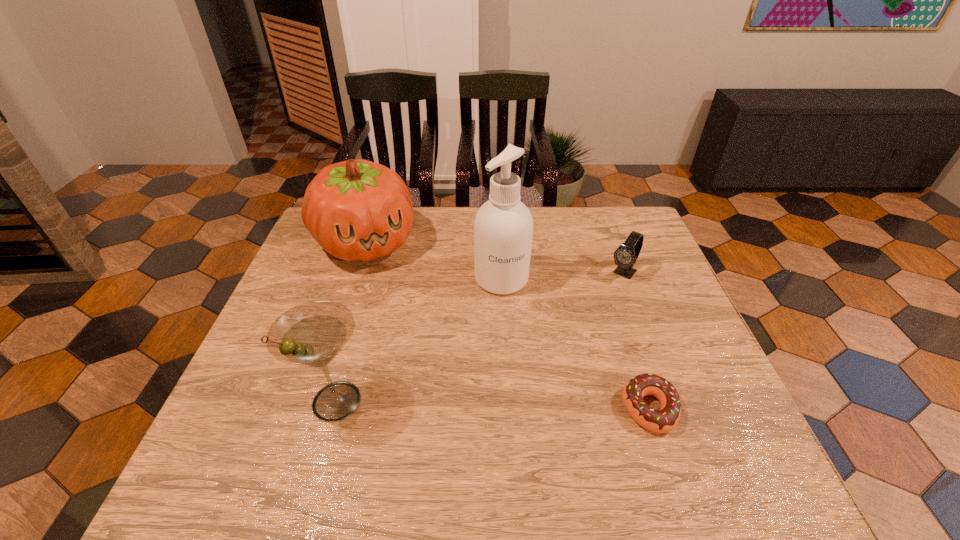
Image resolution: width=960 pixels, height=540 pixels. I want to click on free region located on the face of the fourth tallest object, so click(585, 321).

Where is `vacant space located 0.240m on the side of the pumpkin with the cute face`? The image size is (960, 540). vacant space located 0.240m on the side of the pumpkin with the cute face is located at coordinates (409, 329).

What are the coordinates of `vacant space located 0.330m on the side of the pumpkin with the cute face` in the screenshot? It's located at (421, 355).

The width and height of the screenshot is (960, 540). What are the coordinates of `vacant region located on the side of the pumpkin with the cute face` in the screenshot? It's located at (407, 327).

The height and width of the screenshot is (540, 960). I want to click on vacant space located 0.220m on the front label of the cleansing agent, so tap(524, 362).

Find the location of a particular element. The image size is (960, 540). vacant region located 0.260m on the front label of the cleansing agent is located at coordinates (529, 376).

Where is `free space located 0.390m on the front label of the cleansing agent`? The height and width of the screenshot is (540, 960). free space located 0.390m on the front label of the cleansing agent is located at coordinates [x=543, y=428].

The image size is (960, 540). In order to click on object situated at the far edge in this screenshot , I will do `click(357, 210)`.

At what (x,y) coordinates should I click in order to perform the action: click on martini situated at the near edge. Please return your answer as a coordinate pair (x, y). The width and height of the screenshot is (960, 540). Looking at the image, I should click on (312, 334).

Where is `doughnut present at the near edge`? The image size is (960, 540). doughnut present at the near edge is located at coordinates (664, 420).